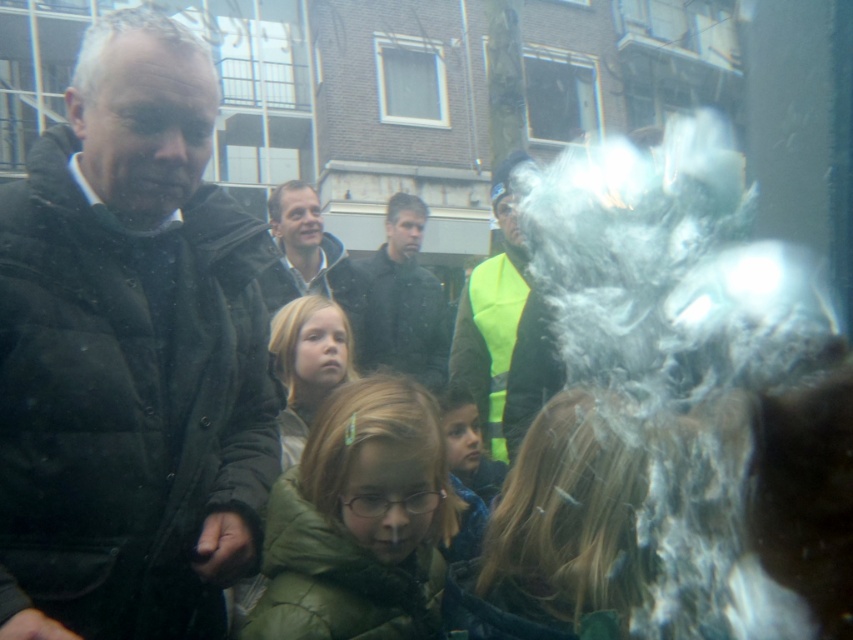
You are standing in front of a large window that is slightly fogged. You notice two jackets at the center of the scene. Which jacket is closer to you, the dark green jacket at center or the matte black jacket at center?

The dark green jacket at center is closer to you because it is positioned over the matte black jacket at center.

You are standing in front of a foggy window and see two points marked on the glass surface. The first point is at coordinate point (413, 355) and the second point is at coordinate point (341, 280). Which point is closer to you on the glass surface?

Point (413, 355) is further to the camera than point (341, 280), so the second point at (341, 280) is closer to you.

You are standing at the point marked by the coordinates point [502,307] and want to walk to the door located at the entrance of the building in the background. The path is clear except for a small dog that is 0.5 meters wide. Can you safely walk around the dog without deviating from your path?

The point marked by the coordinates point [502,307] is 3.65 meters away from the viewer. Since the dog is only 0.5 meters wide, you can safely walk around it by going either left or right of the dog while maintaining your path towards the building entrance.